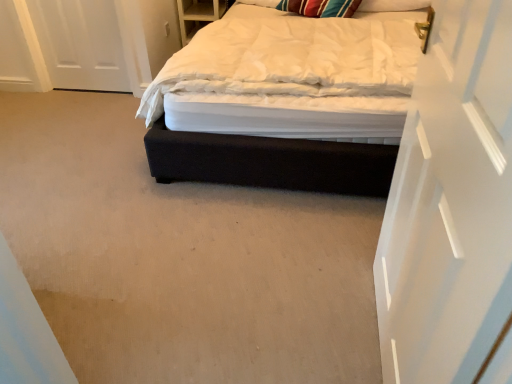
Question: Is striped fabric pillow at upper right located within dark fabric bed at center?

Choices:
 (A) yes
 (B) no

Answer: (A)

Question: Is dark fabric bed at center not within striped fabric pillow at upper right?

Choices:
 (A) yes
 (B) no

Answer: (A)

Question: From a real-world perspective, is dark fabric bed at center on striped fabric pillow at upper right?

Choices:
 (A) no
 (B) yes

Answer: (A)

Question: From a real-world perspective, is dark fabric bed at center positioned under striped fabric pillow at upper right based on gravity?

Choices:
 (A) yes
 (B) no

Answer: (A)

Question: Does dark fabric bed at center appear on the right side of striped fabric pillow at upper right?

Choices:
 (A) yes
 (B) no

Answer: (B)

Question: In terms of height, does striped fabric pillow at upper right look taller or shorter compared to dark fabric bed at center?

Choices:
 (A) tall
 (B) short

Answer: (B)

Question: Is striped fabric pillow at upper right in front of or behind dark fabric bed at center in the image?

Choices:
 (A) behind
 (B) front

Answer: (A)

Question: From the image's perspective, relative to dark fabric bed at center, is striped fabric pillow at upper right above or below?

Choices:
 (A) below
 (B) above

Answer: (B)

Question: Do you think striped fabric pillow at upper right is within dark fabric bed at center, or outside of it?

Choices:
 (A) outside
 (B) inside

Answer: (B)

Question: Is point (493, 241) closer or farther from the camera than point (366, 8)?

Choices:
 (A) closer
 (B) farther

Answer: (A)

Question: Is white glossy door at upper right bigger or smaller than striped fabric pillow at upper right?

Choices:
 (A) small
 (B) big

Answer: (B)

Question: In terms of width, does white glossy door at upper right look wider or thinner when compared to striped fabric pillow at upper right?

Choices:
 (A) wide
 (B) thin

Answer: (B)

Question: Which is correct: white glossy door at upper right is inside striped fabric pillow at upper right, or outside of it?

Choices:
 (A) outside
 (B) inside

Answer: (A)

Question: Is dark fabric bed at center in front of or behind white glossy door at upper right in the image?

Choices:
 (A) behind
 (B) front

Answer: (A)

Question: Is point (373, 117) closer or farther from the camera than point (434, 18)?

Choices:
 (A) closer
 (B) farther

Answer: (B)